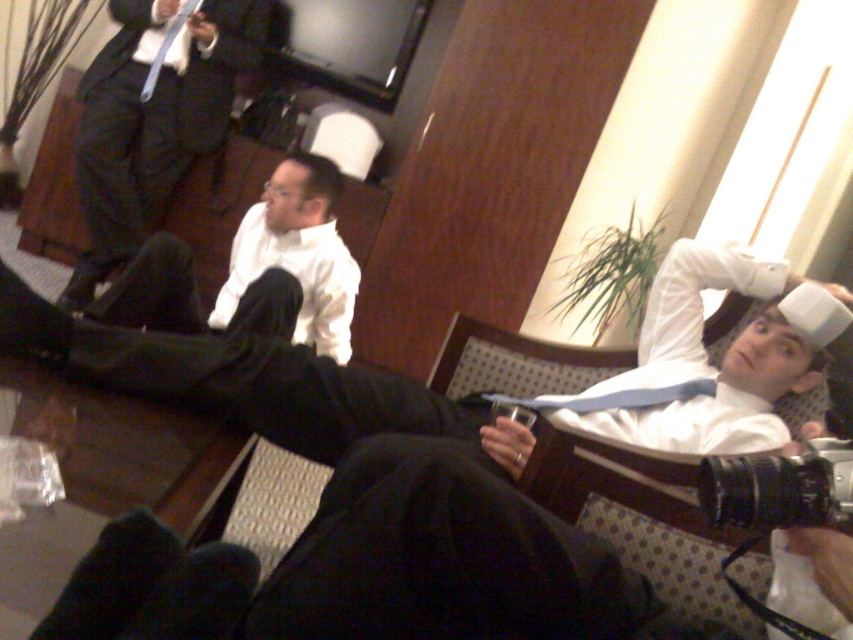
Can you confirm if matte black suit at upper left is positioned to the left of matte blue tie at upper left?

Correct, you'll find matte black suit at upper left to the left of matte blue tie at upper left.

Who is more distant from viewer, (x=215, y=84) or (x=193, y=1)?

Point (x=215, y=84)

At what (x,y) coordinates should I click in order to perform the action: click on matte black suit at upper left. Please return your answer as a coordinate pair (x, y). Looking at the image, I should click on (155, 113).

Between white matte shirt at center and matte blue tie at upper left, which one appears on the right side from the viewer's perspective?

From the viewer's perspective, white matte shirt at center appears more on the right side.

Can you confirm if white matte shirt at center is wider than matte blue tie at upper left?

Indeed, white matte shirt at center has a greater width compared to matte blue tie at upper left.

Find the location of a particular element. This screenshot has width=853, height=640. white matte shirt at center is located at coordinates (296, 253).

Which of these two, matte white cup at upper right or matte blue tie at upper left, stands shorter?

matte blue tie at upper left

The height and width of the screenshot is (640, 853). What are the coordinates of `matte white cup at upper right` in the screenshot? It's located at (254, 381).

You are a GUI agent. You are given a task and a screenshot of the screen. Output one action in this format:
    pyautogui.click(x=<x>, y=<y>)
    Task: Click on the matte white cup at upper right
    This screenshot has height=640, width=853.
    Given the screenshot: What is the action you would take?
    pyautogui.click(x=254, y=381)